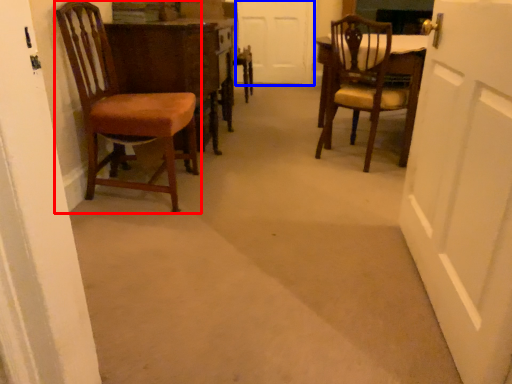
Question: Among these objects, which one is nearest to the camera, chair (highlighted by a red box) or door (highlighted by a blue box)?

Choices:
 (A) chair
 (B) door

Answer: (A)